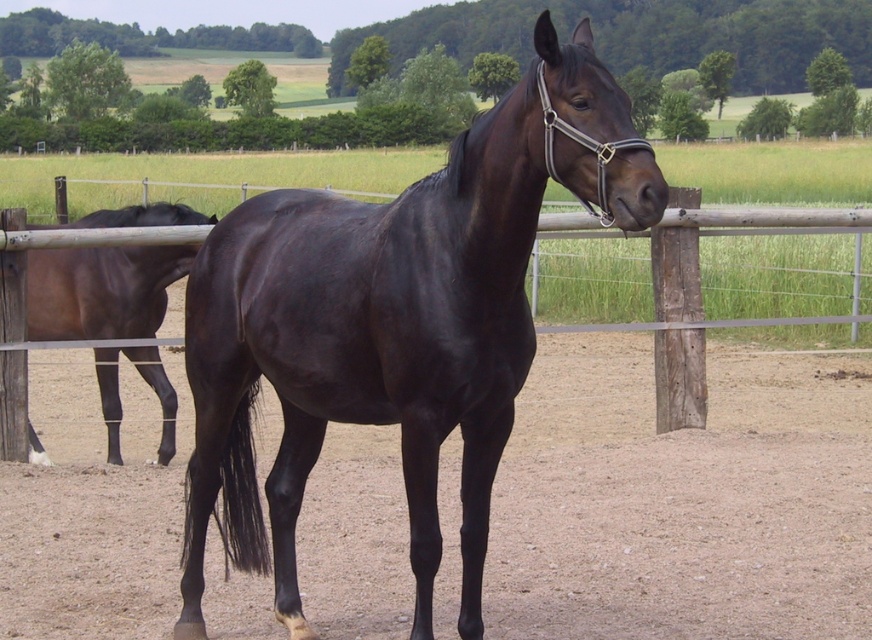
Question: Which of the following is the closest to the observer?

Choices:
 (A) shiny black horse at center
 (B) brown glossy horse at left
 (C) dirt at center
 (D) wooden post at center

Answer: (A)

Question: Which object appears farthest from the camera in this image?

Choices:
 (A) dirt at center
 (B) shiny black horse at center
 (C) wooden post at center
 (D) brown glossy horse at left

Answer: (D)

Question: Which of the following is the farthest from the observer?

Choices:
 (A) (403, 422)
 (B) (789, 220)
 (C) (135, 211)
 (D) (45, 490)

Answer: (C)

Question: Does dirt at center appear under shiny black horse at center?

Choices:
 (A) yes
 (B) no

Answer: (A)

Question: Does dirt at center appear over shiny black horse at center?

Choices:
 (A) yes
 (B) no

Answer: (B)

Question: Is dirt at center behind shiny black horse at center?

Choices:
 (A) no
 (B) yes

Answer: (B)